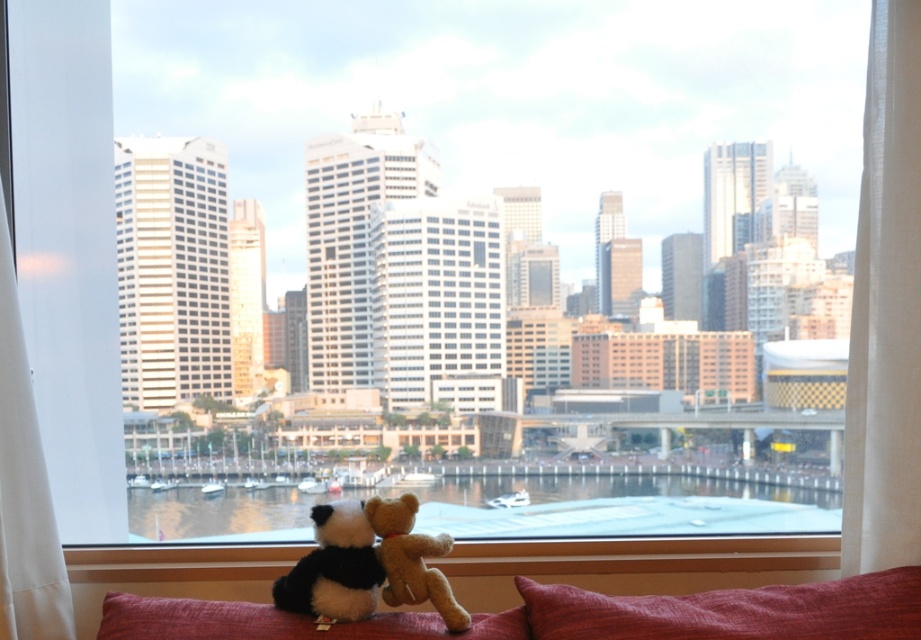
Question: Which object is farther from the camera taking this photo?

Choices:
 (A) velvety red pillow at lower center
 (B) white sheer curtain at left
 (C) white sheer curtain at right

Answer: (C)

Question: Is velvet red couch at lower center positioned behind clear water at center?

Choices:
 (A) no
 (B) yes

Answer: (A)

Question: Estimate the real-world distances between objects in this image. Which object is farther from the velvety red pillow at lower center?

Choices:
 (A) clear water at center
 (B) white sheer curtain at right

Answer: (A)

Question: Does velvet red couch at lower center have a smaller size compared to white sheer curtain at left?

Choices:
 (A) no
 (B) yes

Answer: (B)

Question: Which of the following is the farthest from the observer?

Choices:
 (A) white sheer curtain at right
 (B) white sheer curtain at left

Answer: (A)

Question: Does velvety red pillow at lower center have a greater width compared to brown plush bear at lower center?

Choices:
 (A) yes
 (B) no

Answer: (A)